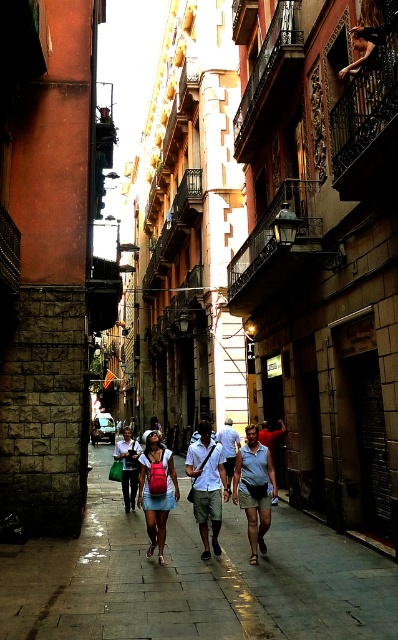
Question: Which of the following is the closest to the observer?

Choices:
 (A) smooth concrete pavement at center
 (B) light blue cotton shirt at center

Answer: (A)

Question: Which object is closer to the camera taking this photo?

Choices:
 (A) smooth concrete pavement at center
 (B) light blue cotton shirt at center
 (C) denim skirt at center

Answer: (A)

Question: Is matte pink backpack at center wider than light blue denim shorts at center?

Choices:
 (A) no
 (B) yes

Answer: (B)

Question: Does light blue cotton shirt at center appear on the left side of light blue denim shorts at center?

Choices:
 (A) no
 (B) yes

Answer: (A)

Question: Can you confirm if denim skirt at center is positioned below light blue denim shorts at center?

Choices:
 (A) no
 (B) yes

Answer: (A)

Question: Which object is positioned closest to the smooth concrete pavement at center?

Choices:
 (A) light blue denim shorts at center
 (B) denim skirt at center
 (C) matte pink backpack at center

Answer: (B)